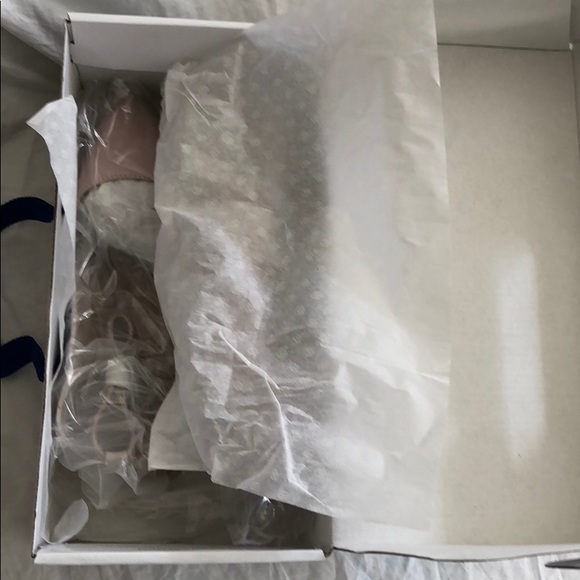
The image size is (580, 580). Identify the location of blanket. (217, 7).